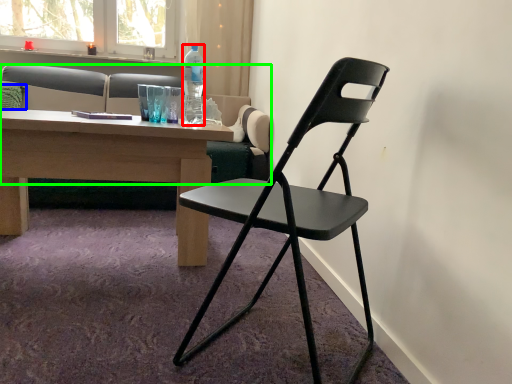
Question: Which object is positioned closest to bottle (highlighted by a red box)? Select from pillow (highlighted by a blue box) and studio couch (highlighted by a green box).

Choices:
 (A) pillow
 (B) studio couch

Answer: (B)